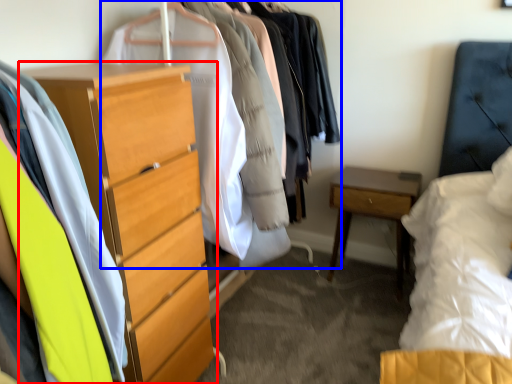
Question: Which point is closer to the camera, chest of drawers (highlighted by a red box) or closet (highlighted by a blue box)?

Choices:
 (A) chest of drawers
 (B) closet

Answer: (A)